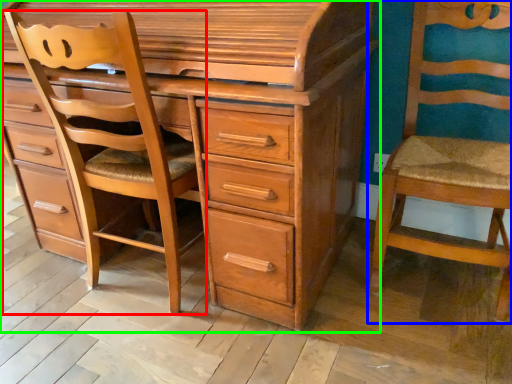
Question: Which object is the closest to the furniture (highlighted by a red box)? Choose among these: chair (highlighted by a blue box) or chest of drawers (highlighted by a green box).

Choices:
 (A) chair
 (B) chest of drawers

Answer: (B)